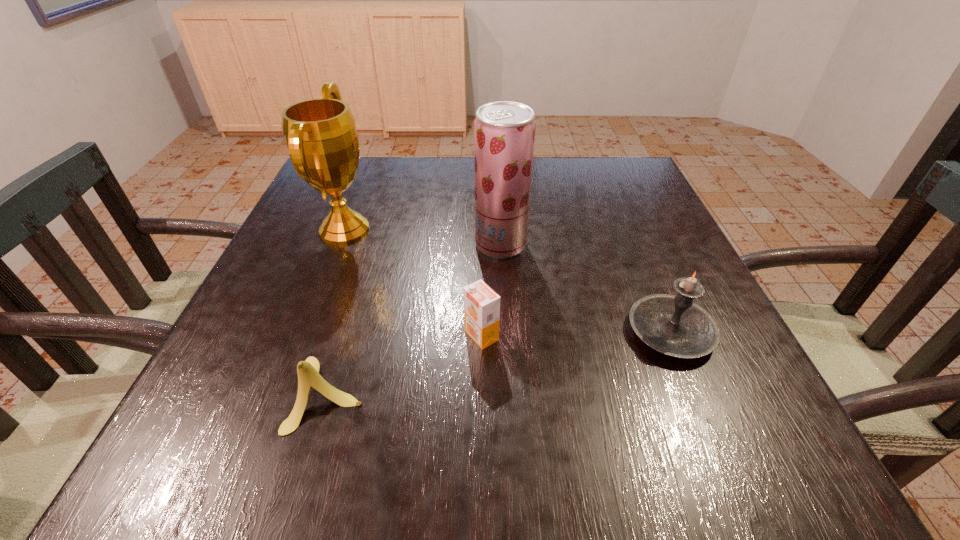
Find the location of `vacant area in the image that satisfies the following two spatial constraints: 1. on the back side of the fruit juice; 2. on the right side of the orange juice`. vacant area in the image that satisfies the following two spatial constraints: 1. on the back side of the fruit juice; 2. on the right side of the orange juice is located at coordinates (481, 244).

This screenshot has width=960, height=540. What are the coordinates of `vacant space that satisfies the following two spatial constraints: 1. on the front-facing side of the award; 2. on the left side of the fruit juice` in the screenshot? It's located at (339, 244).

This screenshot has height=540, width=960. I want to click on vacant region that satisfies the following two spatial constraints: 1. on the front-facing side of the award; 2. on the back side of the orange juice, so click(304, 335).

I want to click on vacant space that satisfies the following two spatial constraints: 1. on the front-facing side of the third shortest object; 2. on the right side of the award, so click(305, 332).

At what (x,y) coordinates should I click in order to perform the action: click on free location that satisfies the following two spatial constraints: 1. on the front-facing side of the banana; 2. on the left side of the award. Please return your answer as a coordinate pair (x, y). Looking at the image, I should click on (282, 393).